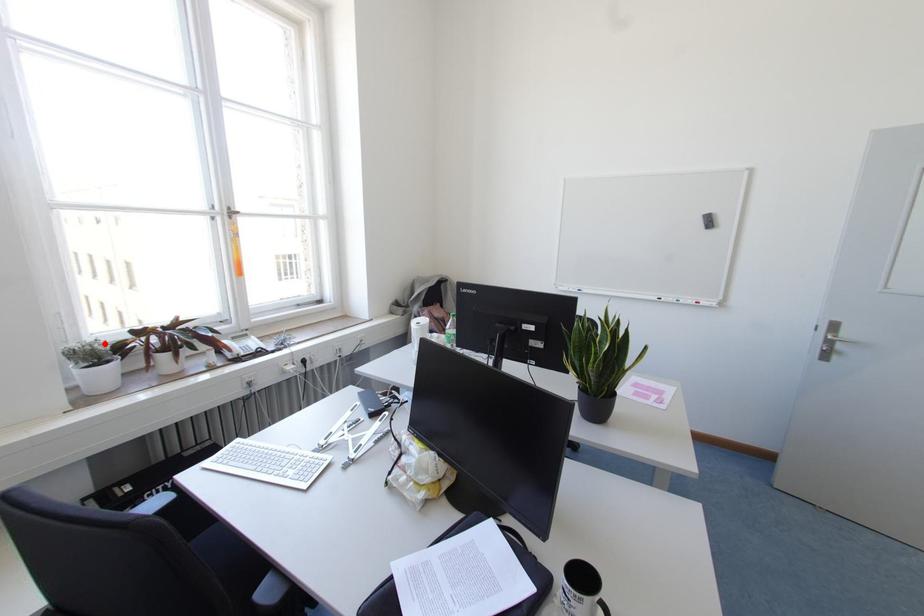
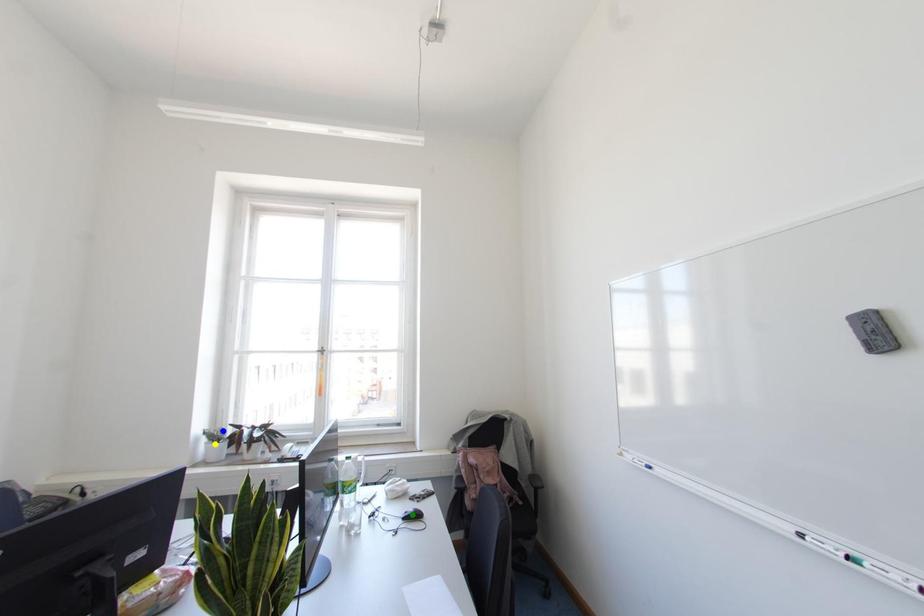
Question: I am providing you with two images of the same scene from different viewpoints. A red point is marked on the first image. You are given multiple points on the second image. Which point in image 2 is actually the same real-world point as the red point in image 1?

Choices:
 (A) blue point
 (B) yellow point
 (C) green point

Answer: (A)